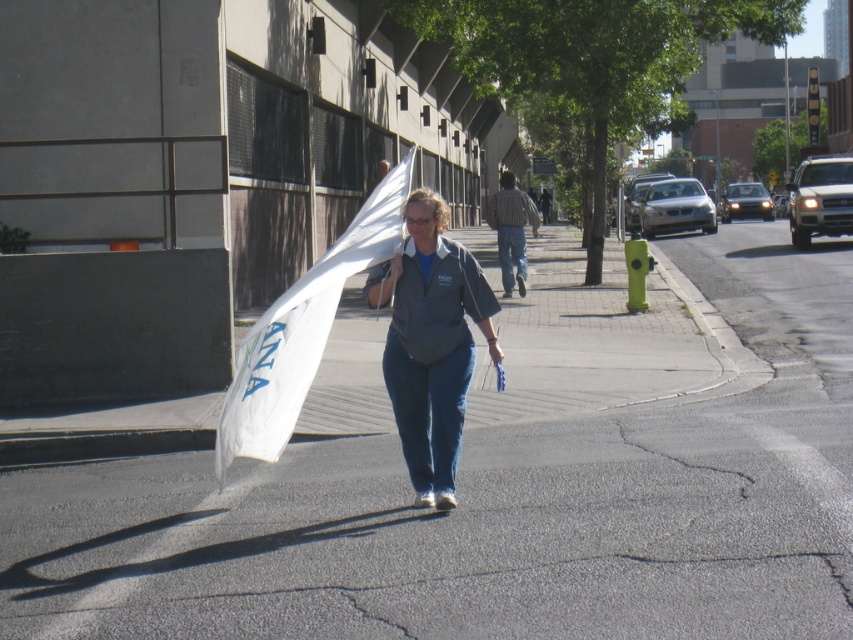
You are standing at the point with coordinates point (415,476) and want to walk to the point with coordinates point (804,426). Given the scene described, is the destination point visible from your current position?

Point (804,426) is behind point (415,476), so the destination point is not visible from your current position.

You are a photographer standing on the sidewalk. You want to take a photo of the asphalt at center and the matte gray shirt at center from a low angle. Which object will appear closer to the bottom of the photo?

The asphalt at center will appear closer to the bottom of the photo because it has a greater height compared to the matte gray shirt at center.